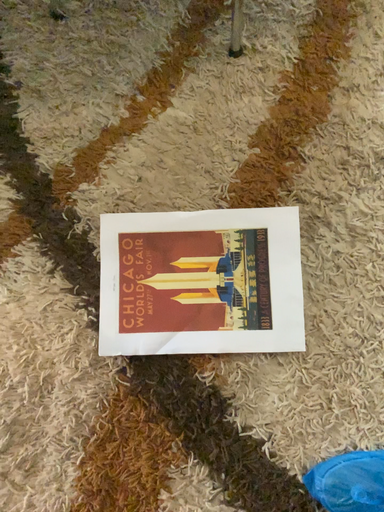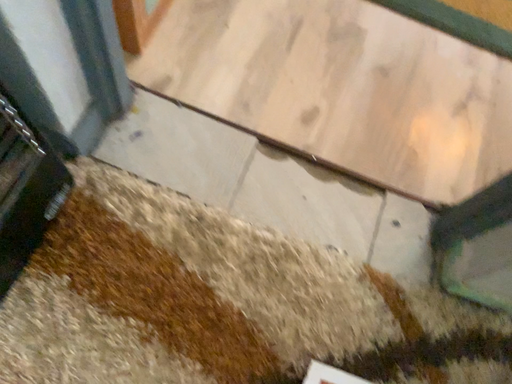
Question: How did the camera likely rotate when shooting the video?

Choices:
 (A) rotated downward
 (B) rotated upward

Answer: (B)